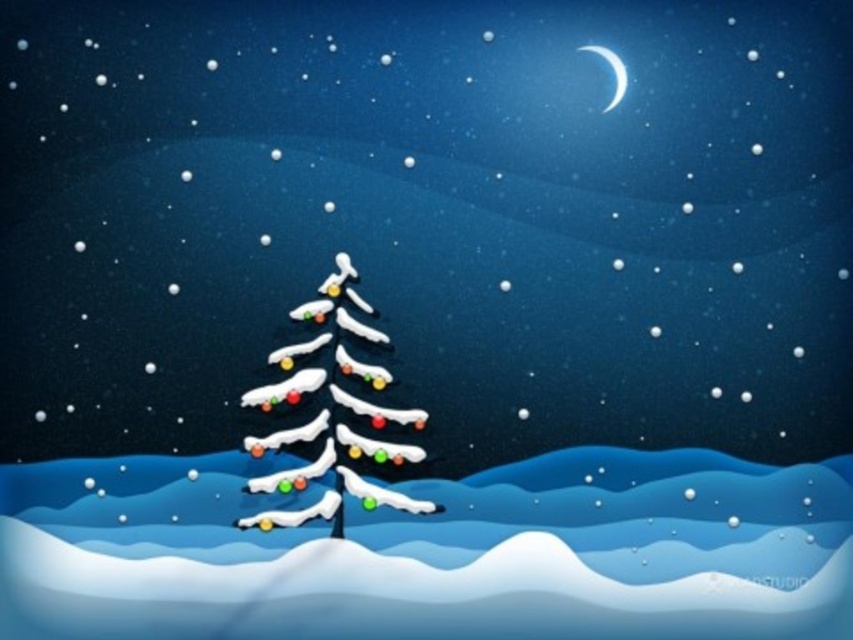
Question: Which object appears closest to the camera in this image?

Choices:
 (A) white glossy crescent moon at upper right
 (B) icy white christmas tree at center

Answer: (B)

Question: Is icy white christmas tree at center further to the viewer compared to white glossy crescent moon at upper right?

Choices:
 (A) yes
 (B) no

Answer: (B)

Question: Where is icy white christmas tree at center located in relation to white glossy crescent moon at upper right in the image?

Choices:
 (A) above
 (B) below

Answer: (B)

Question: Is icy white christmas tree at center positioned in front of white glossy crescent moon at upper right?

Choices:
 (A) yes
 (B) no

Answer: (A)

Question: Which point is farther from the camera taking this photo?

Choices:
 (A) (613, 106)
 (B) (328, 292)

Answer: (B)